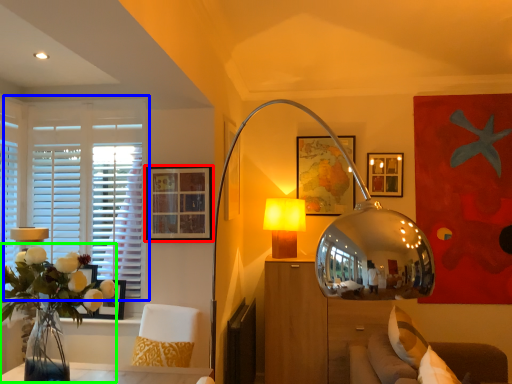
Question: Based on their relative distances, which object is farther from picture frame (highlighted by a red box)? Choose from window (highlighted by a blue box) and floral arrangement (highlighted by a green box).

Choices:
 (A) window
 (B) floral arrangement

Answer: (B)